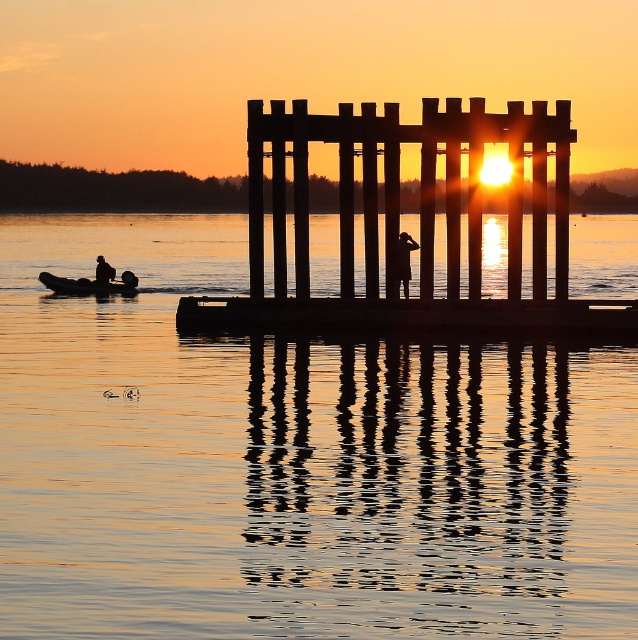
You are standing at the edge of the water and want to place a buoy exactly where the wooden at center is located. According to the coordinates provided, where should you place the buoy?

The wooden at center is located at coordinates point (419, 188), so place the buoy at that exact point.

You are standing at the point marked by the coordinates point (419, 188) and want to walk towards the wooden at center. Which direction should you go?

The wooden at center is located at point (419, 188), so you are already at the same location as the wooden at center.